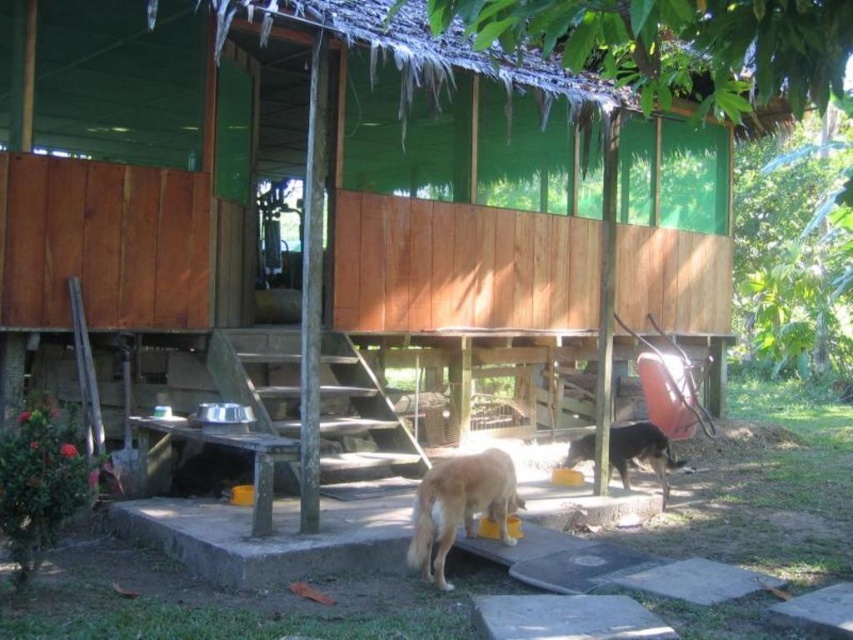
You are standing at the base of the wooden steps leading to the cabin. You see a golden fur dog at lower center and a brown fur dog at lower center. Which dog is closer to you?

The golden fur dog at lower center is closer to you because it is positioned over the brown fur dog at lower center, indicating it is in front and nearer to your viewpoint.

Please provide the 2D coordinates of the golden fur dog at lower center in the image.

The golden fur dog at lower center is located at coordinates (459, 506).

You are a visitor approaching the wooden platform where the entrance is located. You see a golden fur dog at lower center and a brown fur dog at lower center. Can you safely walk between them without stepping on either dog? Please explain your reasoning based on the distance between them.

The golden fur dog at lower center and brown fur dog at lower center are 7.23 feet apart. Since the average person requires about 2 feet of space to walk comfortably between two objects, the 7.23 feet distance allows sufficient space to walk safely between them without stepping on either dog.